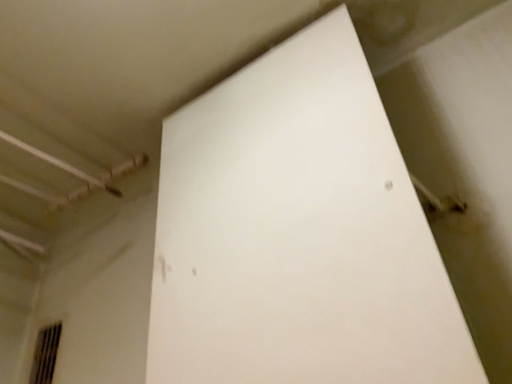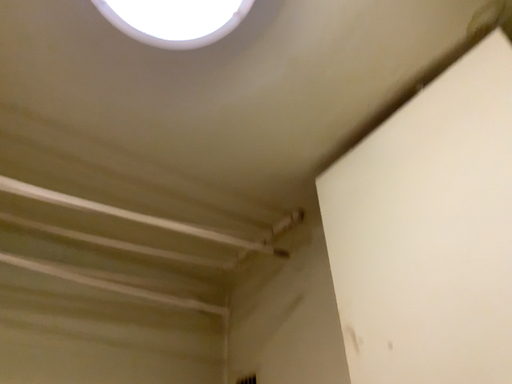
Question: Which way did the camera rotate in the video?

Choices:
 (A) rotated left
 (B) rotated right

Answer: (A)